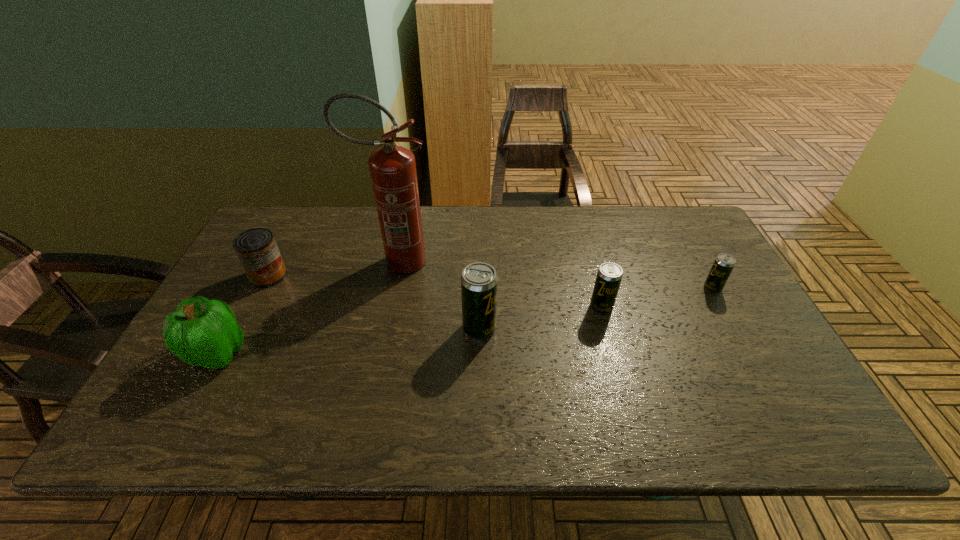
Find the location of a particular element. The image size is (960, 540). vacant region between the nearest beer can and the bell pepper is located at coordinates (348, 341).

The height and width of the screenshot is (540, 960). I want to click on free space that is in between the third object from right to left and the can, so click(373, 302).

This screenshot has width=960, height=540. I want to click on free spot between the rightmost beer can and the tallest object, so click(554, 275).

This screenshot has height=540, width=960. Find the location of `vacant point located between the bell pepper and the can`. vacant point located between the bell pepper and the can is located at coordinates (243, 315).

This screenshot has width=960, height=540. What are the coordinates of `free point between the tallest beer can and the can` in the screenshot? It's located at (373, 302).

Find the location of `object that can be found as the fourth closest to the fire extinguisher`. object that can be found as the fourth closest to the fire extinguisher is located at coordinates (609, 275).

The image size is (960, 540). I want to click on object that ranks as the fourth closest to the can, so click(609, 275).

Find the location of a particular element. beer can identified as the second closest to the shortest object is located at coordinates (479, 282).

Find the location of a particular element. the closest beer can to the shortest object is located at coordinates pyautogui.click(x=609, y=275).

The width and height of the screenshot is (960, 540). Find the location of `free location that satisfies the following two spatial constraints: 1. on the back side of the nearest beer can; 2. from the nozzle of the fire extinguisher`. free location that satisfies the following two spatial constraints: 1. on the back side of the nearest beer can; 2. from the nozzle of the fire extinguisher is located at coordinates (479, 262).